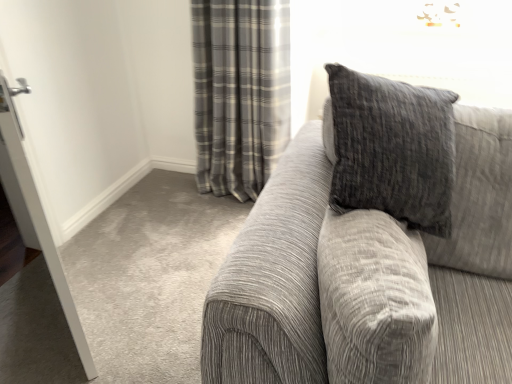
Question: Should I look upward or downward to see textured gray couch at right?

Choices:
 (A) down
 (B) up

Answer: (A)

Question: Is white glossy door at left surrounding textured gray couch at right?

Choices:
 (A) no
 (B) yes

Answer: (A)

Question: Does white glossy door at left have a lesser height compared to textured gray couch at right?

Choices:
 (A) no
 (B) yes

Answer: (A)

Question: Is white glossy door at left in contact with textured gray couch at right?

Choices:
 (A) no
 (B) yes

Answer: (A)

Question: Could you tell me if white glossy door at left is turned towards textured gray couch at right?

Choices:
 (A) no
 (B) yes

Answer: (A)

Question: Considering the relative sizes of white glossy door at left and textured gray couch at right in the image provided, is white glossy door at left taller than textured gray couch at right?

Choices:
 (A) no
 (B) yes

Answer: (B)

Question: Can you confirm if white glossy door at left is smaller than textured gray couch at right?

Choices:
 (A) no
 (B) yes

Answer: (B)

Question: From a real-world perspective, is gray plaid curtain at upper center under white glossy door at left?

Choices:
 (A) no
 (B) yes

Answer: (B)

Question: From the image's perspective, is gray plaid curtain at upper center above white glossy door at left?

Choices:
 (A) yes
 (B) no

Answer: (A)

Question: Considering the relative sizes of gray plaid curtain at upper center and white glossy door at left in the image provided, is gray plaid curtain at upper center shorter than white glossy door at left?

Choices:
 (A) yes
 (B) no

Answer: (A)

Question: Is gray plaid curtain at upper center aimed at white glossy door at left?

Choices:
 (A) no
 (B) yes

Answer: (B)

Question: Does gray plaid curtain at upper center have a greater width compared to white glossy door at left?

Choices:
 (A) no
 (B) yes

Answer: (B)

Question: Does gray plaid curtain at upper center have a larger size compared to white glossy door at left?

Choices:
 (A) yes
 (B) no

Answer: (A)

Question: Considering the relative sizes of white glossy door at left and gray plaid curtain at upper center in the image provided, is white glossy door at left taller than gray plaid curtain at upper center?

Choices:
 (A) no
 (B) yes

Answer: (B)